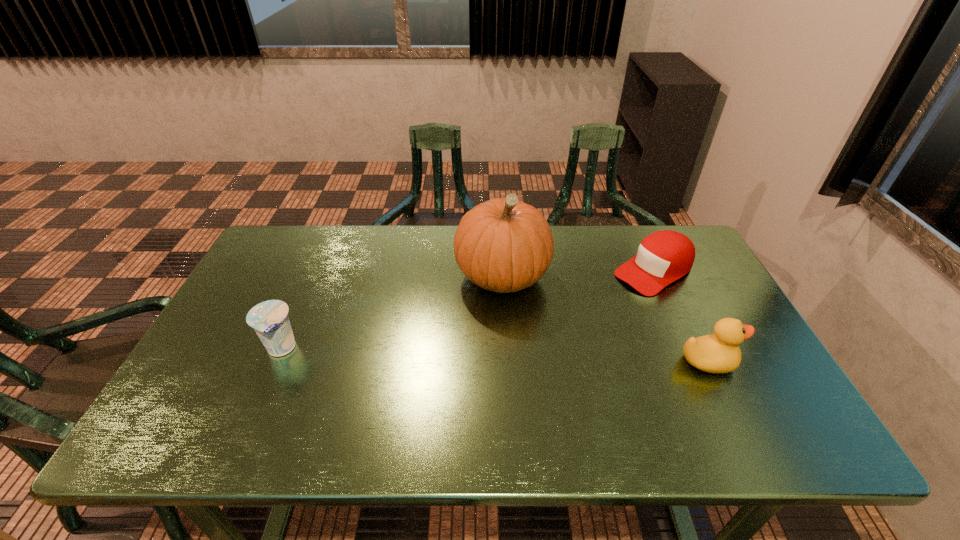
This screenshot has width=960, height=540. Find the location of `vacant space situated on the front-facing side of the baseball cap`. vacant space situated on the front-facing side of the baseball cap is located at coordinates (532, 343).

Find the location of `free point located 0.380m on the front-facing side of the baseball cap`. free point located 0.380m on the front-facing side of the baseball cap is located at coordinates (529, 345).

Where is `pumpkin that is at the far edge`? This screenshot has width=960, height=540. pumpkin that is at the far edge is located at coordinates (504, 245).

You are a GUI agent. You are given a task and a screenshot of the screen. Output one action in this format:
    pyautogui.click(x=<x>, y=<y>)
    Task: Click on the baseball cap positioned at the far edge
    The height and width of the screenshot is (540, 960).
    Given the screenshot: What is the action you would take?
    pyautogui.click(x=663, y=257)

At what (x,y) coordinates should I click in order to perform the action: click on object located in the left edge section of the desktop. Please return your answer as a coordinate pair (x, y). This screenshot has height=540, width=960. Looking at the image, I should click on (269, 319).

Where is `duck that is positioned at the right edge`? This screenshot has height=540, width=960. duck that is positioned at the right edge is located at coordinates (717, 353).

Locate an element on the screen. baseball cap that is at the right edge is located at coordinates (663, 257).

You are a GUI agent. You are given a task and a screenshot of the screen. Output one action in this format:
    pyautogui.click(x=<x>, y=<y>)
    Task: Click on the object that is at the far right corner
    This screenshot has width=960, height=540.
    Given the screenshot: What is the action you would take?
    [x=663, y=257]

This screenshot has height=540, width=960. In the image, there is a desktop. Identify the location of vacant space at the far edge. (364, 251).

The image size is (960, 540). In the image, there is a desktop. Identify the location of vacant space at the near edge. (565, 409).